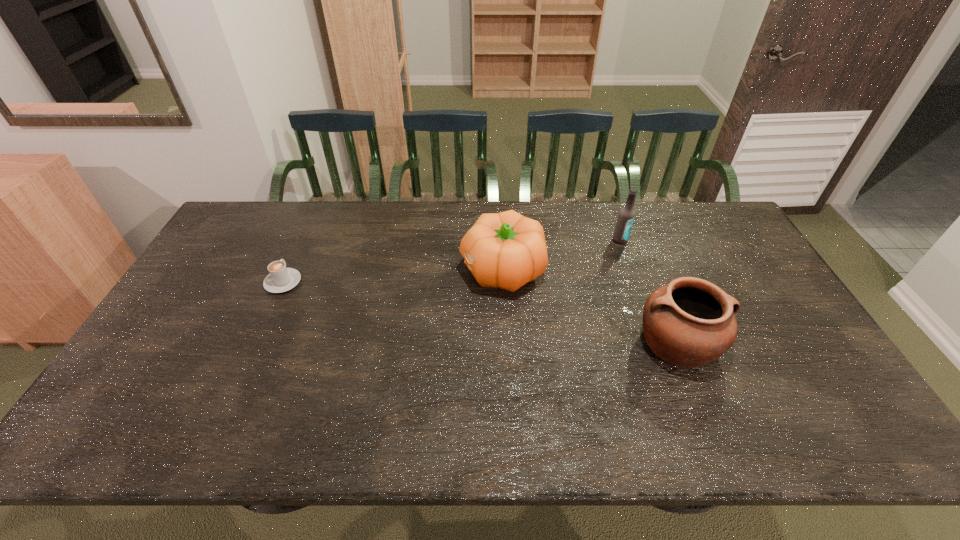
The width and height of the screenshot is (960, 540). In the image, there is a desktop. In order to click on vacant space at the far right corner in this screenshot , I will do `click(697, 220)`.

Image resolution: width=960 pixels, height=540 pixels. I want to click on free space that is in between the cappuccino and the third object from right to left, so (393, 276).

Locate an element on the screen. free space between the pottery and the beer bottle is located at coordinates (649, 291).

The image size is (960, 540). I want to click on blank region between the cappuccino and the pumpkin, so click(393, 276).

This screenshot has height=540, width=960. What are the coordinates of `free space between the nearest object and the second object from left to right` in the screenshot? It's located at (590, 306).

Find the location of a particular element. This screenshot has height=540, width=960. free spot between the third tallest object and the pumpkin is located at coordinates (590, 306).

I want to click on free space that is in between the leftmost object and the beer bottle, so click(451, 261).

The image size is (960, 540). I want to click on empty space between the beer bottle and the second shortest object, so click(x=649, y=291).

In order to click on vacant point located between the leftmost object and the pumpkin in this screenshot , I will do `click(393, 276)`.

Image resolution: width=960 pixels, height=540 pixels. Find the location of `free space between the nearest object and the beer bottle`. free space between the nearest object and the beer bottle is located at coordinates (649, 291).